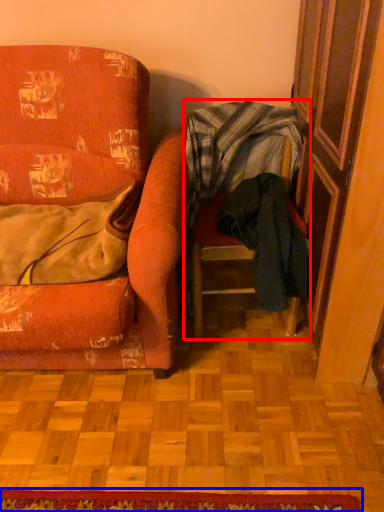
Question: Which object appears closest to the camera in this image, chair (highlighted by a red box) or doormat (highlighted by a blue box)?

Choices:
 (A) chair
 (B) doormat

Answer: (B)